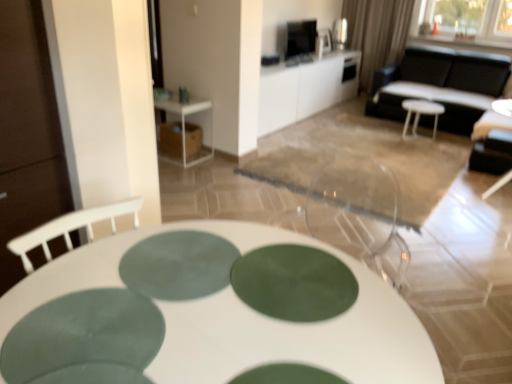
Question: Is black leather couch at upper right taller or shorter than green matte placemat at center?

Choices:
 (A) short
 (B) tall

Answer: (B)

Question: Considering the positions of black leather couch at upper right and green matte placemat at center in the image, is black leather couch at upper right bigger or smaller than green matte placemat at center?

Choices:
 (A) small
 (B) big

Answer: (B)

Question: Which is nearer to the green matte placemat at center?

Choices:
 (A) white plastic stool at center
 (B) white plastic side table at upper left, acting as the second table starting from the back
 (C) black leather chair at right
 (D) green fabric curtain at upper right
 (E) white glossy cabinet at upper center, which is the third table from bottom to top

Answer: (B)

Question: Which object is positioned closest to the white plastic side table at upper left, acting as the second table starting from the back?

Choices:
 (A) black leather couch at upper right
 (B) white glossy table at center, placed as the 1th table when sorted from front to back
 (C) green fabric curtain at upper right
 (D) white plastic stool at center
 (E) green matte placemat at center

Answer: (D)